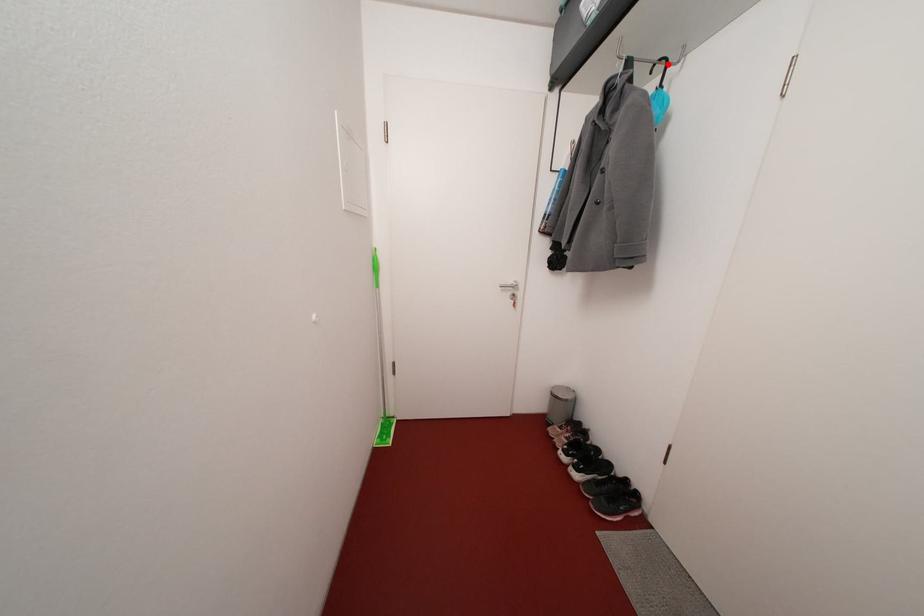
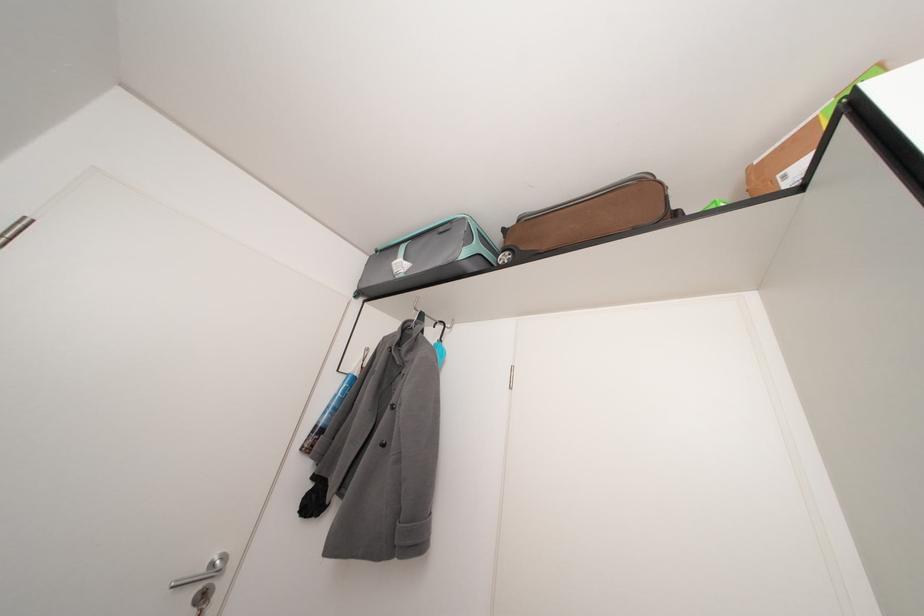
Where in the second image is the point corresponding to the highlighted location from the first image?

(447, 328)